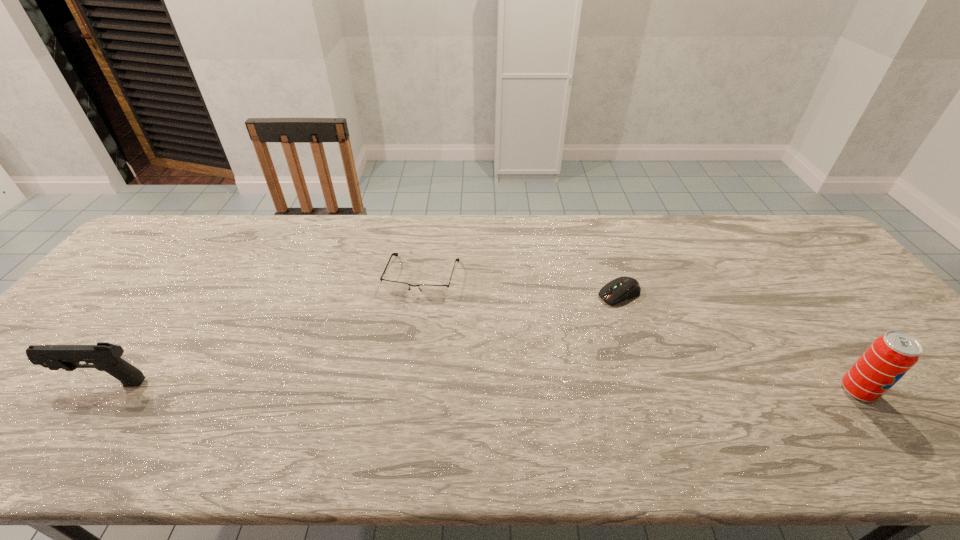
Locate an element on the screen. The height and width of the screenshot is (540, 960). vacant space at the left edge of the desktop is located at coordinates (113, 325).

Find the location of a particular element. free area in between the computer equipment and the soda can is located at coordinates (738, 342).

Locate an element on the screen. The image size is (960, 540). empty location between the pistol and the tallest object is located at coordinates (481, 387).

What are the coordinates of `vacant area that lies between the second tallest object and the rightmost object` in the screenshot? It's located at (481, 387).

Find the location of `free spot between the soda can and the leftmost object`. free spot between the soda can and the leftmost object is located at coordinates (481, 387).

The image size is (960, 540). What are the coordinates of `empty space between the tallest object and the second object from left to right` in the screenshot? It's located at (640, 333).

Identify the location of free space between the third object from right to left and the third object from left to right. (520, 285).

The height and width of the screenshot is (540, 960). Find the location of `vacant area that lies between the rightmost object and the second object from left to right`. vacant area that lies between the rightmost object and the second object from left to right is located at coordinates (640, 333).

This screenshot has height=540, width=960. Find the location of `free spot between the third object from left to right and the pistol`. free spot between the third object from left to right and the pistol is located at coordinates (361, 338).

Locate an element on the screen. vacant region between the second object from left to right and the pistol is located at coordinates (263, 329).